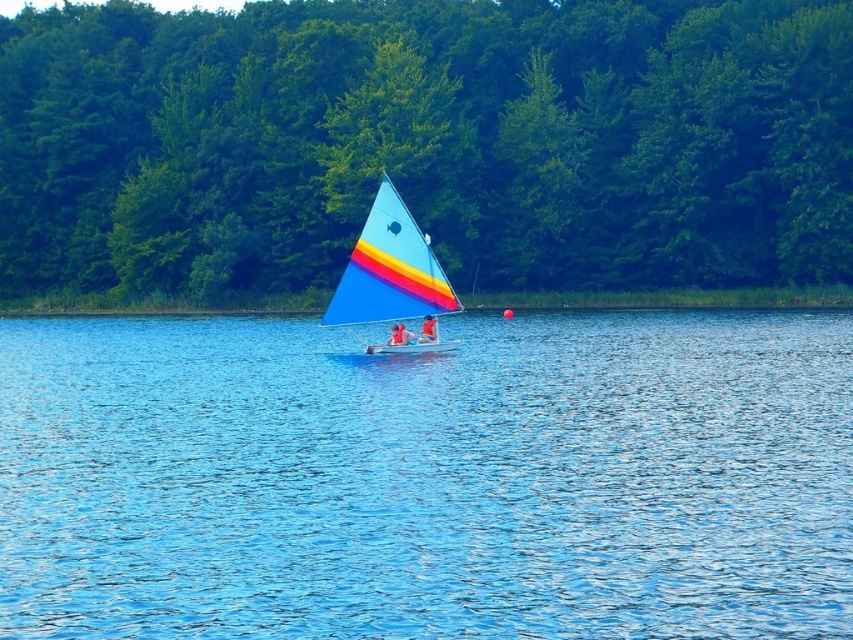
Question: Among these objects, which one is nearest to the camera?

Choices:
 (A) blue water at center
 (B) green leafy trees at center

Answer: (A)

Question: Which object is the farthest from the matte blue sailboat at center?

Choices:
 (A) blue water at center
 (B) green leafy trees at center

Answer: (B)

Question: Is blue water at center thinner than matte blue sailboat at center?

Choices:
 (A) no
 (B) yes

Answer: (A)

Question: Can you confirm if blue water at center is positioned above green leafy trees at center?

Choices:
 (A) no
 (B) yes

Answer: (A)

Question: Considering the relative positions of blue water at center and green leafy trees at center in the image provided, where is blue water at center located with respect to green leafy trees at center?

Choices:
 (A) below
 (B) above

Answer: (A)

Question: Considering the real-world distances, which object is closest to the matte blue sailboat at center?

Choices:
 (A) blue water at center
 (B) green leafy trees at center

Answer: (A)